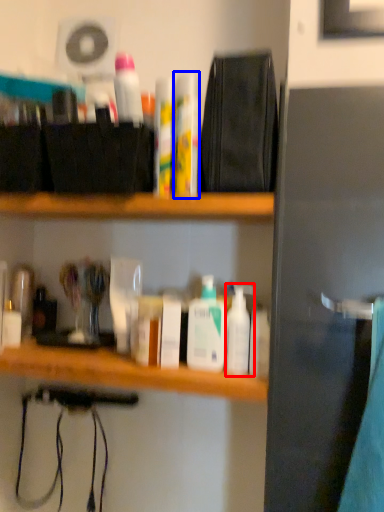
Question: Which object is closer to the camera taking this photo, toiletry (highlighted by a red box) or toiletry (highlighted by a blue box)?

Choices:
 (A) toiletry
 (B) toiletry

Answer: (B)